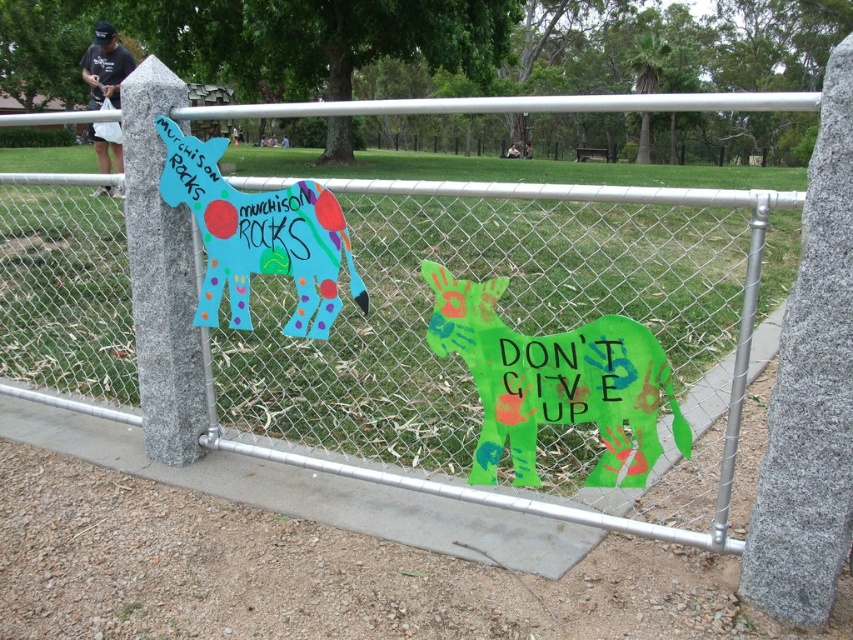
What is the color of the shirt represented by the point at coordinates (105, 65)?

The black cotton shirt at upper left is represented by point (105, 65), so the color is black.